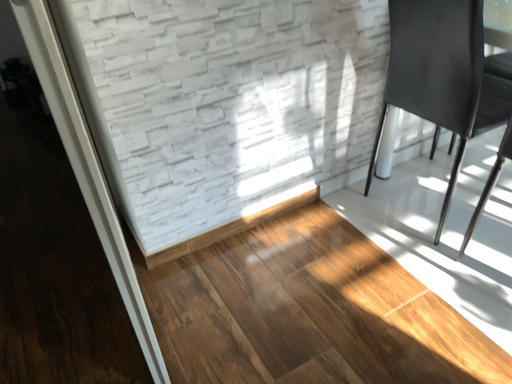
Find the location of a particular element. free space to the left of matte black chair at right is located at coordinates (343, 232).